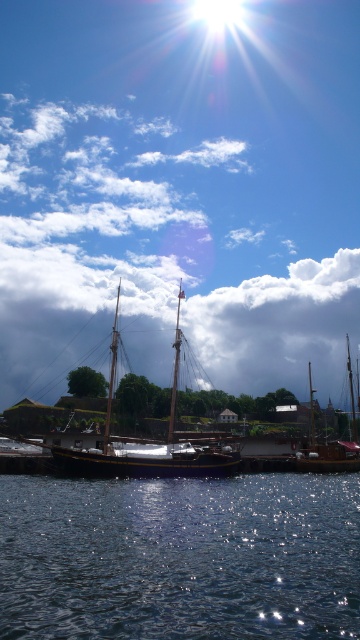
You are standing at the edge of the harbor and want to take a photo of the glistening dark water at lower center. According to the coordinates provided, where should you aim your camera to capture it?

You should aim your camera at point 0.872 on the horizontal axis and 0.500 on the vertical axis to capture the glistening dark water at lower center.

Based on the scene described, which object occupies more horizontal space in the image? The cloudy sky at center or the wooden mast at center?

The cloudy sky at center is wider than the wooden mast at center according to the description.

Consider the image. You are standing at the edge of the harbor and see the point labeled as point (x=180, y=557). What does this point represent in the scene?

The point (x=180, y=557) corresponds to glistening dark water at lower center.